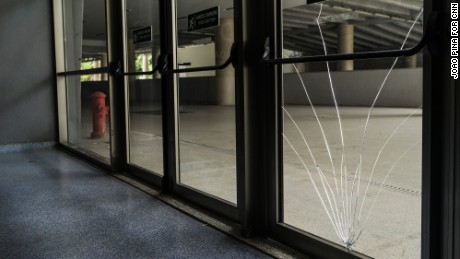
The height and width of the screenshot is (259, 460). I want to click on cement floor, so click(320, 188), click(368, 154), click(213, 130), click(197, 155), click(143, 141), click(145, 117), click(98, 142).